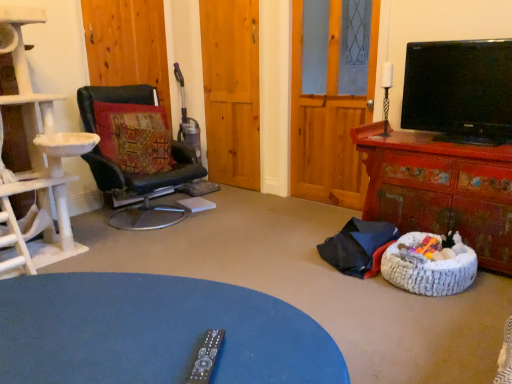
Find the location of a particular element. The width and height of the screenshot is (512, 384). vacant area located to the right-hand side of black leather chair at left is located at coordinates (238, 215).